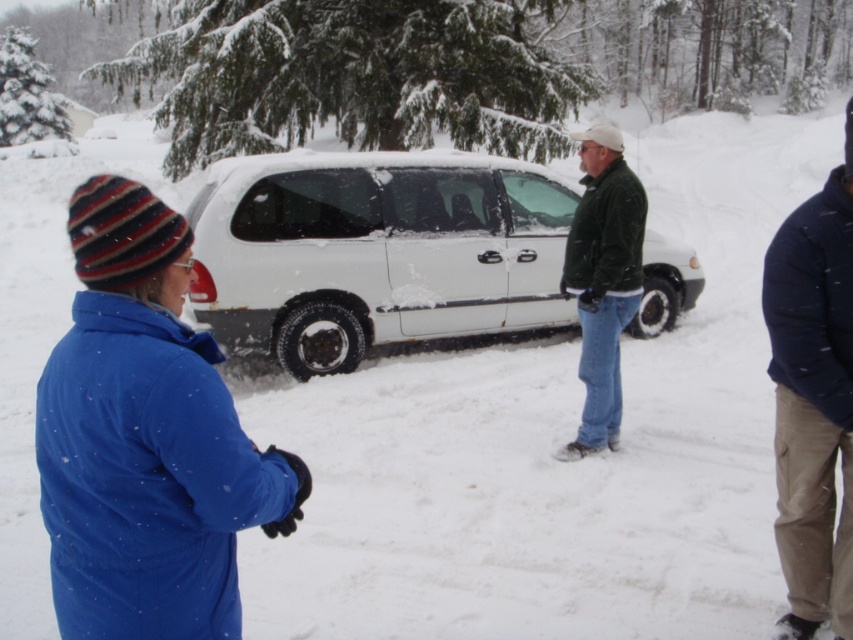
Question: Estimate the real-world distances between objects in this image. Which object is closer to the white matte van at center?

Choices:
 (A) dark blue fleece jacket at right
 (B) green fuzzy jacket at center

Answer: (B)

Question: Which point is farther to the camera?

Choices:
 (A) (601, 300)
 (B) (805, 369)

Answer: (A)

Question: Is white matte van at center below green fuzzy jacket at center?

Choices:
 (A) yes
 (B) no

Answer: (A)

Question: Which is farther from the green fuzzy jacket at center?

Choices:
 (A) dark blue fleece jacket at right
 (B) white matte van at center

Answer: (B)

Question: Does white matte van at center have a larger size compared to dark blue fleece jacket at right?

Choices:
 (A) yes
 (B) no

Answer: (B)

Question: Does white matte van at center have a greater width compared to green fuzzy jacket at center?

Choices:
 (A) no
 (B) yes

Answer: (B)